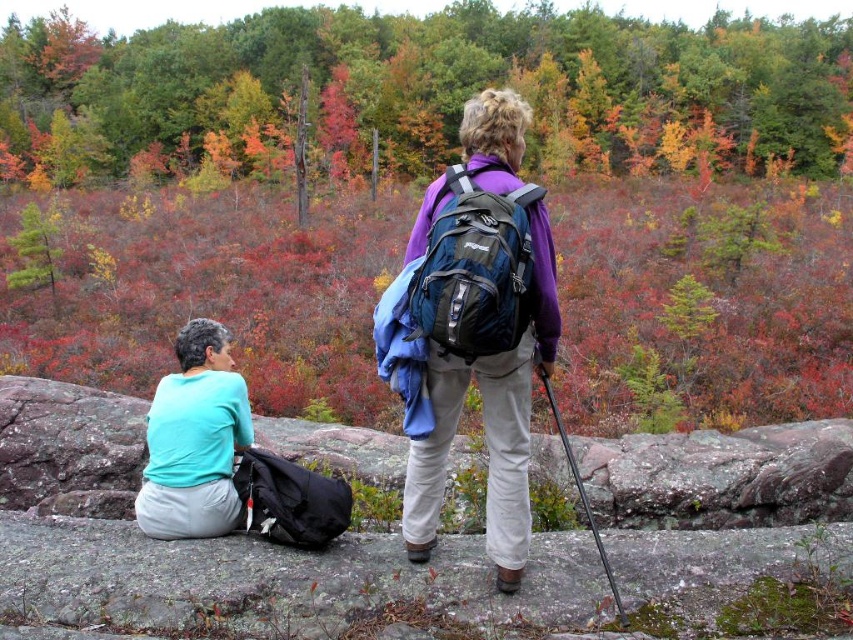
Question: Which of the following is the closest to the observer?

Choices:
 (A) purple matte jacket at center
 (B) purple fabric backpack at center

Answer: (A)

Question: Estimate the real-world distances between objects in this image. Which object is farther from the autumn leaves at upper center?

Choices:
 (A) purple matte jacket at center
 (B) purple fabric backpack at center
 (C) blue fabric backpack at center
 (D) matte black backpack at lower left

Answer: (A)

Question: Can you confirm if matte black backpack at lower left is thinner than blue fabric backpack at center?

Choices:
 (A) no
 (B) yes

Answer: (B)

Question: Is autumn leaves at upper center closer to the viewer compared to matte black backpack at lower left?

Choices:
 (A) yes
 (B) no

Answer: (B)

Question: Which object is farther from the camera taking this photo?

Choices:
 (A) matte black backpack at lower left
 (B) blue fabric backpack at center
 (C) autumn leaves at upper center

Answer: (C)

Question: Is autumn leaves at upper center below matte black backpack at lower left?

Choices:
 (A) yes
 (B) no

Answer: (B)